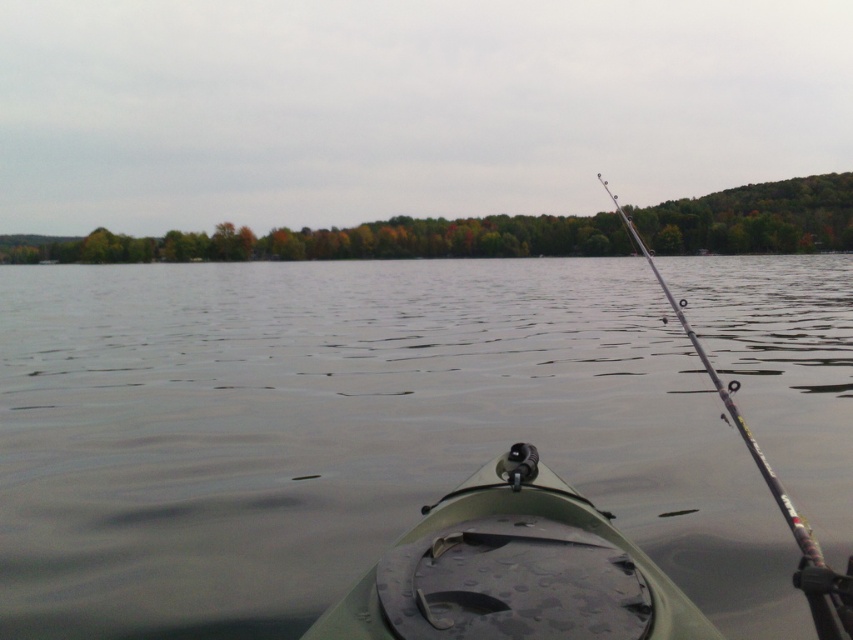
Question: Among these points, which one is farthest from the camera?

Choices:
 (A) (372, 621)
 (B) (100, 417)
 (C) (704, 353)

Answer: (B)

Question: Which of the following is the closest to the observer?

Choices:
 (A) (790, 506)
 (B) (129, 451)
 (C) (341, 630)

Answer: (C)

Question: Does green matte kayak at center appear on the left side of silver metallic rod at right?

Choices:
 (A) yes
 (B) no

Answer: (A)

Question: Can you confirm if transparent water at center is positioned below silver metallic rod at right?

Choices:
 (A) yes
 (B) no

Answer: (B)

Question: Observing the image, what is the correct spatial positioning of green matte kayak at center in reference to silver metallic rod at right?

Choices:
 (A) left
 (B) right

Answer: (A)

Question: Which object is positioned closest to the silver metallic rod at right?

Choices:
 (A) green matte kayak at center
 (B) transparent water at center

Answer: (A)